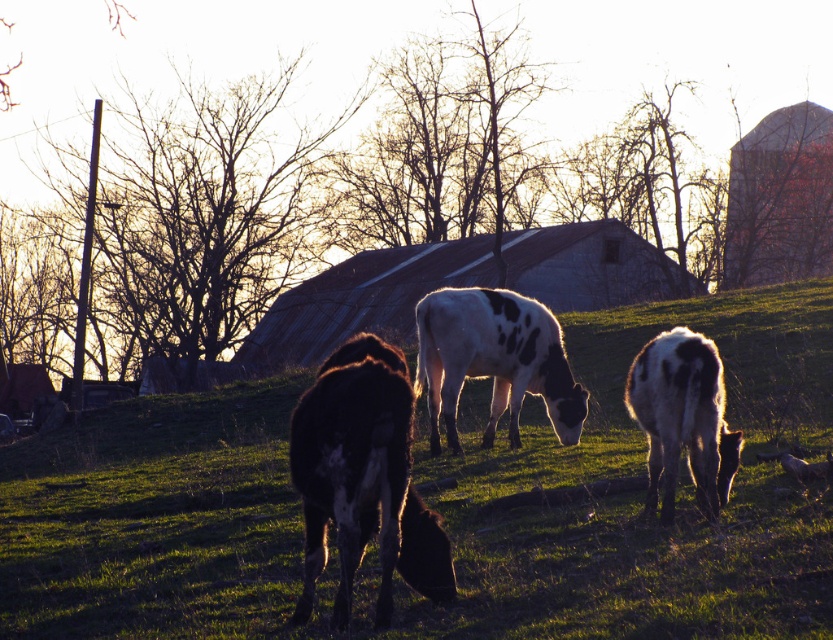
In the scene shown: Measure the distance between black glossy cow at center and white-spotted fur calf at lower right.

2.47 meters

Can you confirm if black glossy cow at center is thinner than white-spotted fur calf at lower right?

No, black glossy cow at center is not thinner than white-spotted fur calf at lower right.

Where is `black glossy cow at center`? black glossy cow at center is located at coordinates (363, 477).

Identify the location of black glossy cow at center. (x=363, y=477).

Between black glossy cow at center and white spotted cow at center, which one has more height?

white spotted cow at center is taller.

Which of these two, black glossy cow at center or white spotted cow at center, stands shorter?

Standing shorter between the two is black glossy cow at center.

Where is `black glossy cow at center`? The width and height of the screenshot is (833, 640). black glossy cow at center is located at coordinates (363, 477).

In the scene shown: Is green grassy at center to the right of black glossy cow at center from the viewer's perspective?

Indeed, green grassy at center is positioned on the right side of black glossy cow at center.

Is point (295, 577) behind point (335, 508)?

That is True.

What are the coordinates of `green grassy at center` in the screenshot? It's located at (641, 493).